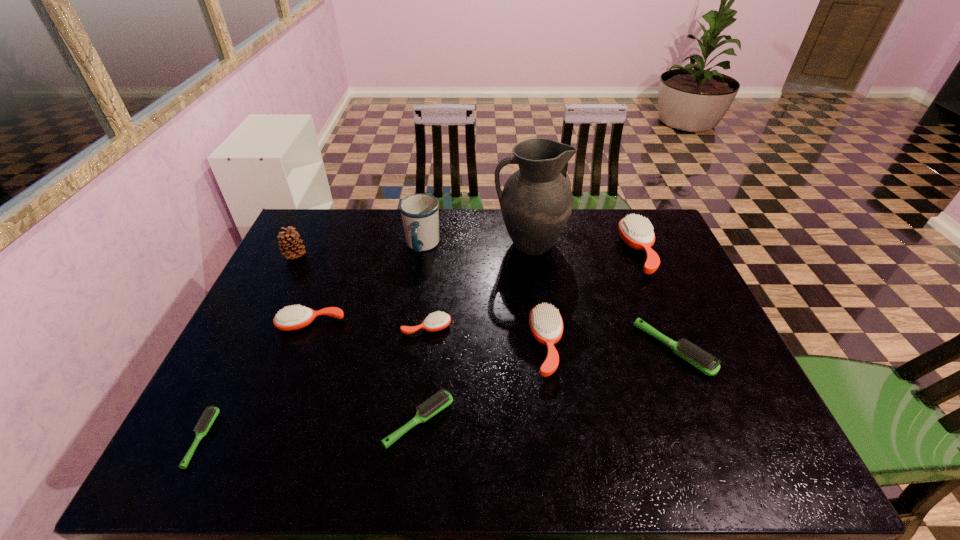
Locate an element on the screen. free space located on the handle side of the white mug is located at coordinates point(404,364).

Where is `vacant space located on the front of the pinecone`? The height and width of the screenshot is (540, 960). vacant space located on the front of the pinecone is located at coordinates (256, 334).

You are a GUI agent. You are given a task and a screenshot of the screen. Output one action in this format:
    pyautogui.click(x=<x>, y=<y>)
    Task: Click on the vacant area located on the left of the farthest orange hairbrush
    This screenshot has width=960, height=540.
    Given the screenshot: What is the action you would take?
    click(561, 252)

The image size is (960, 540). Identify the location of free location located 0.140m on the front of the second tallest hairbrush. (560, 437).

Find the location of a particular element. free space located on the back of the second hairbrush from left to right is located at coordinates coord(347,231).

Where is `free space located on the left of the farthest light hairbrush`? The image size is (960, 540). free space located on the left of the farthest light hairbrush is located at coordinates (550, 349).

The height and width of the screenshot is (540, 960). Identify the location of vacant space situated on the back of the third orange hairbrush from right to left. (437, 245).

Where is `blank space located 0.260m on the right of the second light hairbrush from left to right`? The image size is (960, 540). blank space located 0.260m on the right of the second light hairbrush from left to right is located at coordinates (569, 421).

Find the location of a particular element. The width and height of the screenshot is (960, 540). free space located on the right of the shortest hairbrush is located at coordinates (329, 438).

You are a GUI agent. You are given a task and a screenshot of the screen. Output one action in this format:
    pyautogui.click(x=<x>, y=<y>)
    Task: Click on the pitcher present at the far edge
    This screenshot has height=540, width=960.
    Given the screenshot: What is the action you would take?
    pyautogui.click(x=536, y=202)